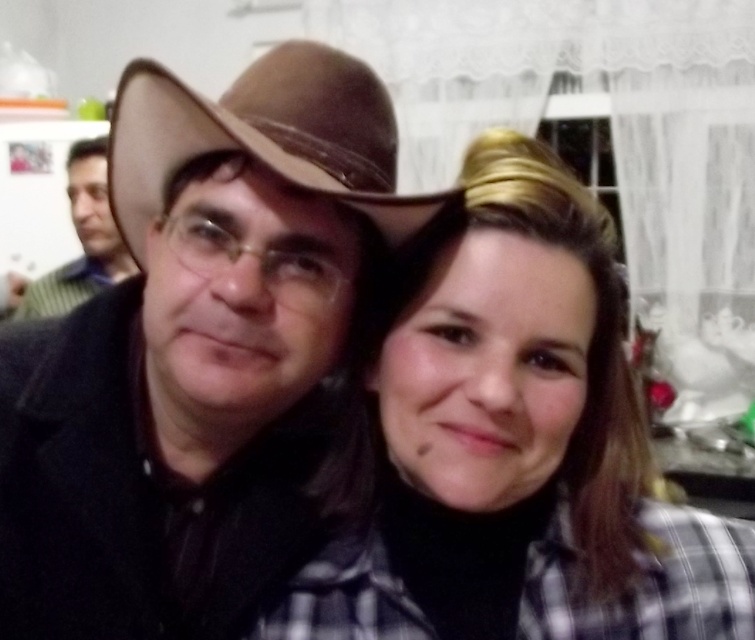
Question: Can you confirm if plaid fabric shirt at center is positioned above brown leather cowboy hat at upper left?

Choices:
 (A) no
 (B) yes

Answer: (A)

Question: Based on their relative distances, which object is farther from the matte black shirt at left?

Choices:
 (A) plaid fabric shirt at center
 (B) brown leather cowboy hat at upper left

Answer: (A)

Question: Which object is the closest to the brown leather cowboy hat at upper left?

Choices:
 (A) plaid fabric shirt at center
 (B) matte black shirt at left

Answer: (A)

Question: Does brown leather cowboy hat at upper left come in front of matte black shirt at left?

Choices:
 (A) yes
 (B) no

Answer: (A)

Question: Which object is positioned farthest from the plaid fabric shirt at center?

Choices:
 (A) brown leather cowboy hat at upper left
 (B) matte black shirt at left

Answer: (B)

Question: Does plaid fabric shirt at center have a lesser width compared to matte black shirt at left?

Choices:
 (A) no
 (B) yes

Answer: (B)